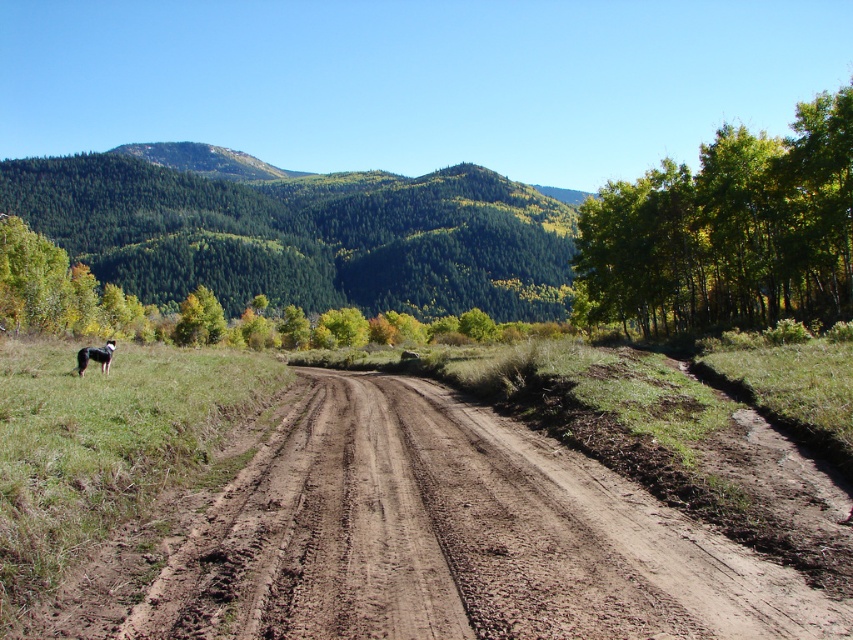
Which is more to the right, green leafy trees at right or black fur dog at lower left?

green leafy trees at right is more to the right.

Describe the element at coordinates (728, 230) in the screenshot. This screenshot has width=853, height=640. I see `green leafy trees at right` at that location.

At what (x,y) coordinates should I click in order to perform the action: click on green leafy trees at right. Please return your answer as a coordinate pair (x, y). Looking at the image, I should click on (728, 230).

Who is positioned more to the left, green forested hillside at upper left or black fur dog at lower left?

green forested hillside at upper left

Can you confirm if green forested hillside at upper left is shorter than black fur dog at lower left?

No.

This screenshot has width=853, height=640. I want to click on green forested hillside at upper left, so click(x=305, y=236).

Locate an element on the screen. brown dirt track at center is located at coordinates (422, 540).

Identify the location of brown dirt track at center. (422, 540).